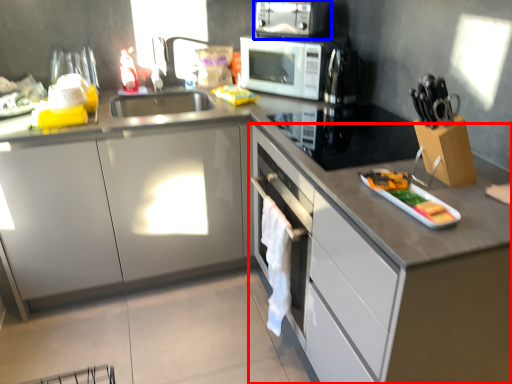
Question: Which object is closer to the camera taking this photo, cabinetry (highlighted by a red box) or kitchen appliance (highlighted by a blue box)?

Choices:
 (A) cabinetry
 (B) kitchen appliance

Answer: (A)